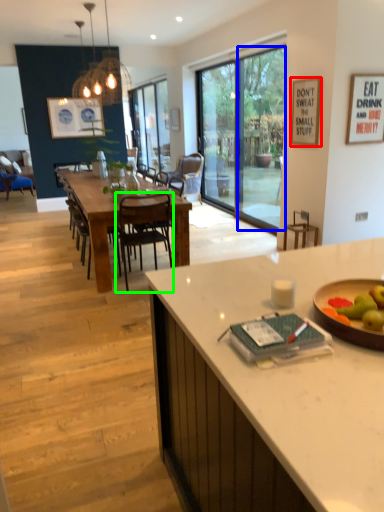
Question: Based on their relative distances, which object is nearer to picture frame (highlighted by a red box)? Choose from window screen (highlighted by a blue box) and chair (highlighted by a green box).

Choices:
 (A) window screen
 (B) chair

Answer: (A)